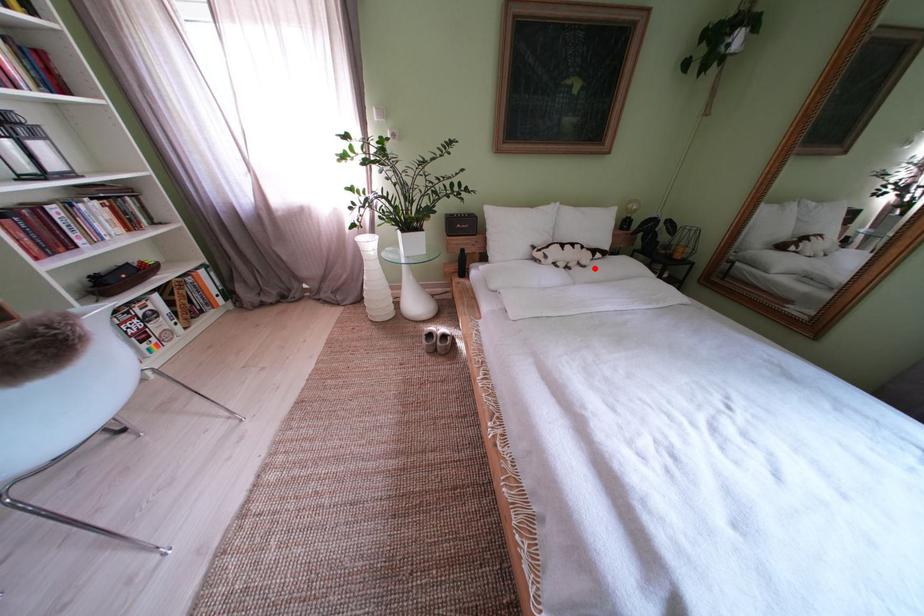
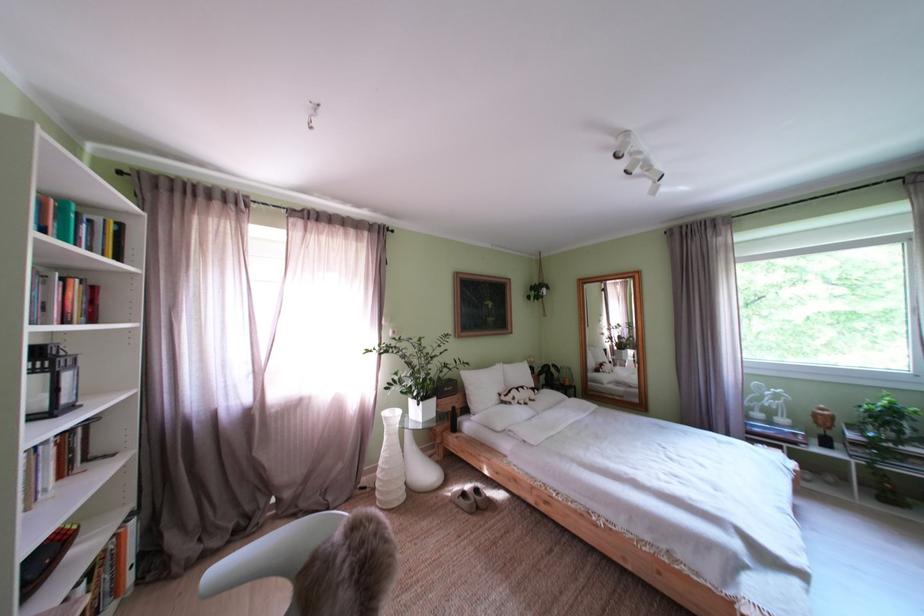
Find the pixel in the second image that matches the highlighted location in the first image.

(543, 403)